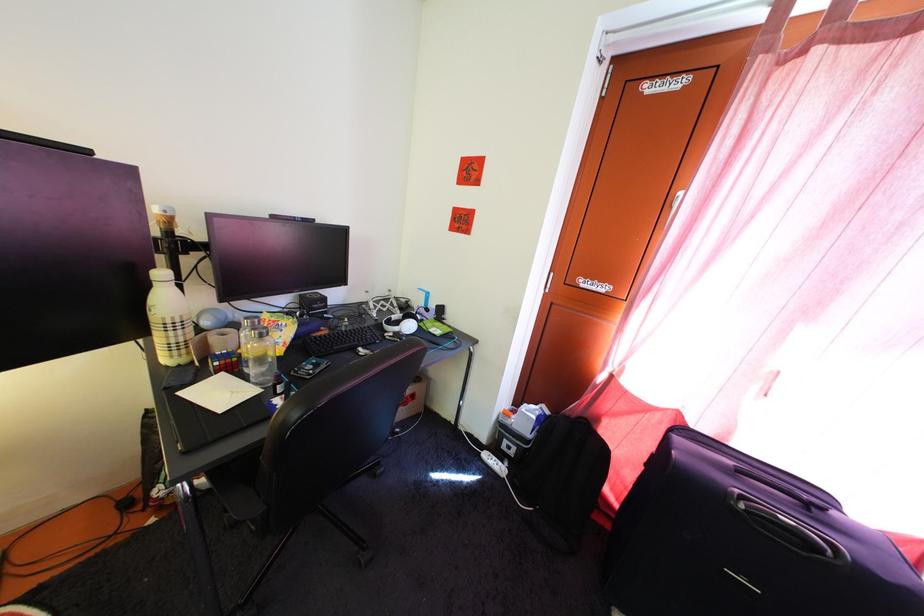
Image resolution: width=924 pixels, height=616 pixels. What do you see at coordinates (493, 463) in the screenshot? I see `the power strip switch` at bounding box center [493, 463].